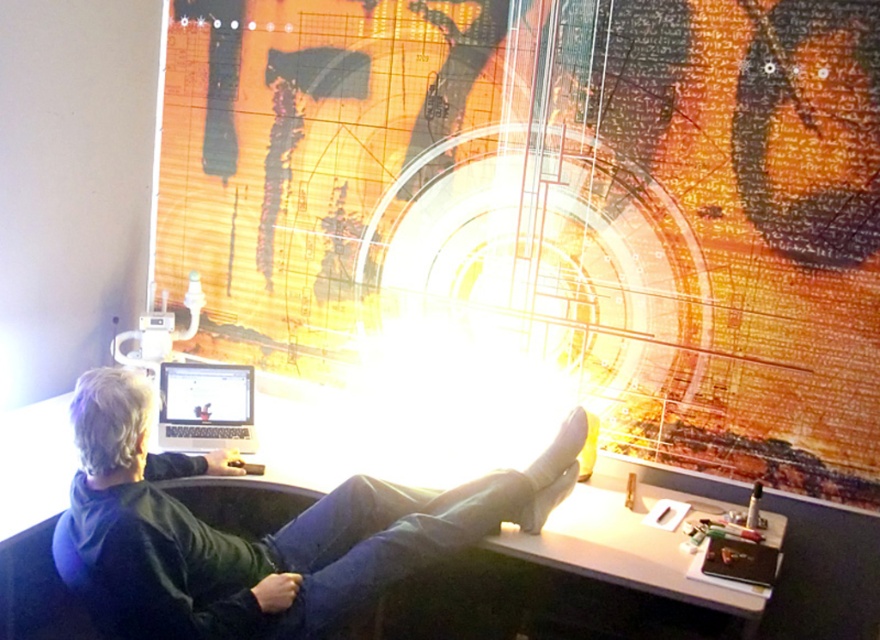
Is point (83, 529) positioned behind point (189, 362)?

No, it is not.

Who is lower down, black leather jacket at center or satin black laptop at lower left?

Positioned lower is black leather jacket at center.

This screenshot has width=880, height=640. I want to click on black leather jacket at center, so click(x=262, y=538).

Is matte orange poster at upper center thinner than black leather jacket at center?

In fact, matte orange poster at upper center might be wider than black leather jacket at center.

Is matte orange poster at upper center bigger than black leather jacket at center?

Yes, matte orange poster at upper center is bigger than black leather jacket at center.

Which is behind, point (878, 17) or point (110, 417)?

Positioned behind is point (878, 17).

Where is `matte orange poster at upper center`? matte orange poster at upper center is located at coordinates (554, 204).

In the scene shown: Can you confirm if matte orange poster at upper center is thinner than satin black laptop at lower left?

In fact, matte orange poster at upper center might be wider than satin black laptop at lower left.

In the scene shown: Does matte orange poster at upper center come in front of satin black laptop at lower left?

Yes, matte orange poster at upper center is in front of satin black laptop at lower left.

Image resolution: width=880 pixels, height=640 pixels. Find the location of `matte orange poster at upper center`. matte orange poster at upper center is located at coordinates (554, 204).